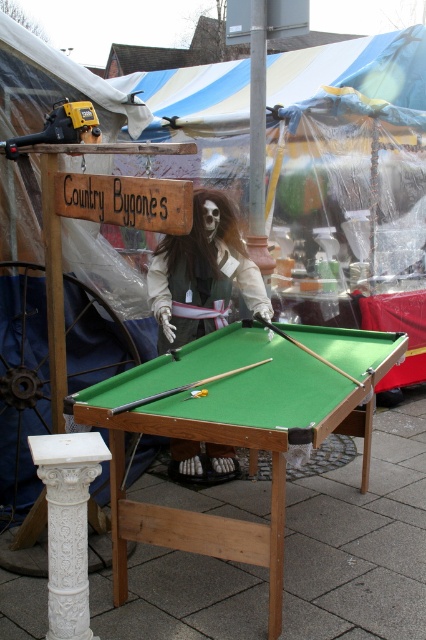
Question: Does green felt pool table at center have a greater width compared to white fabric skeleton at center?

Choices:
 (A) no
 (B) yes

Answer: (B)

Question: Does green felt pool table at center appear over smooth wood cue at center?

Choices:
 (A) yes
 (B) no

Answer: (B)

Question: Among these objects, which one is farthest from the camera?

Choices:
 (A) green felt pool table at center
 (B) white fabric skeleton at center
 (C) wooden smooth cue at center

Answer: (B)

Question: Which point appears closest to the camera in this image?

Choices:
 (A) (307, 353)
 (B) (192, 326)
 (C) (270, 356)

Answer: (C)

Question: Is white fabric skeleton at center behind wooden smooth cue at center?

Choices:
 (A) no
 (B) yes

Answer: (B)

Question: Which of the following is the farthest from the observer?

Choices:
 (A) white fabric skeleton at center
 (B) wooden smooth cue at center
 (C) green felt pool table at center

Answer: (A)